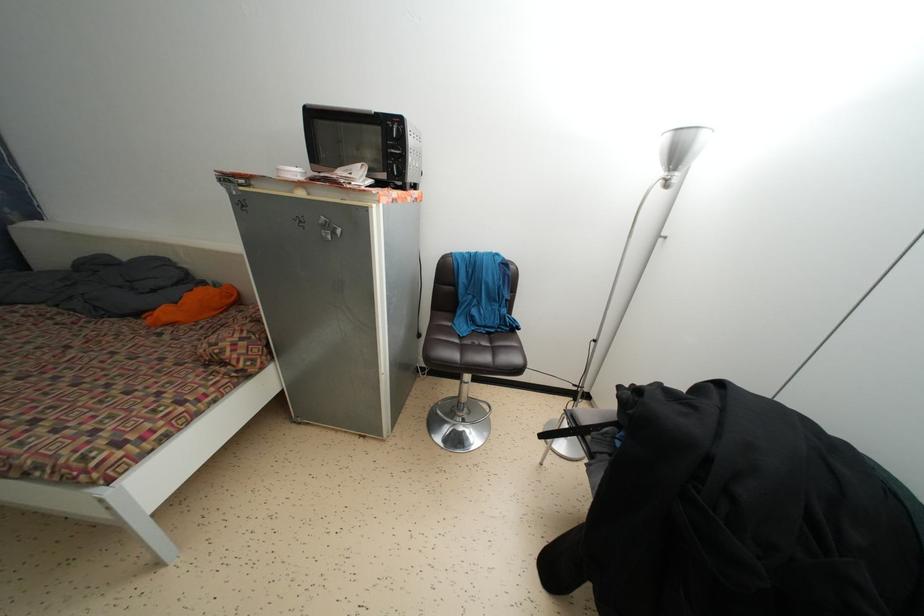
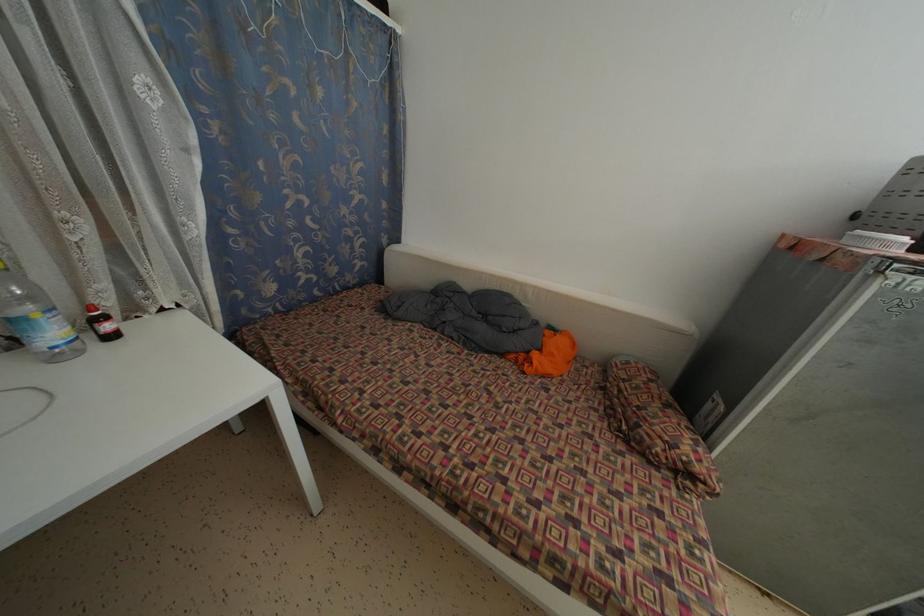
Question: The images are taken continuously from a first-person perspective. In which direction are you moving?

Choices:
 (A) Left
 (B) Right
 (C) Forward
 (D) Backward

Answer: (A)